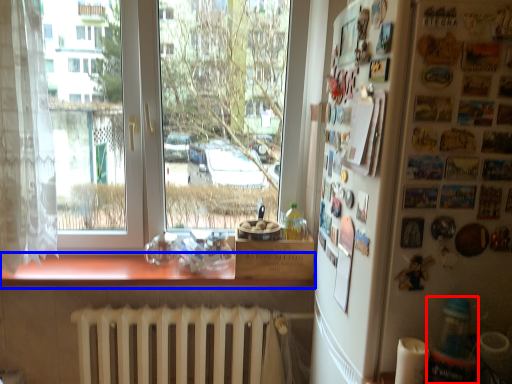
Question: Which object is closer to the camera taking this photo, bottle (highlighted by a red box) or counter top (highlighted by a blue box)?

Choices:
 (A) bottle
 (B) counter top

Answer: (A)